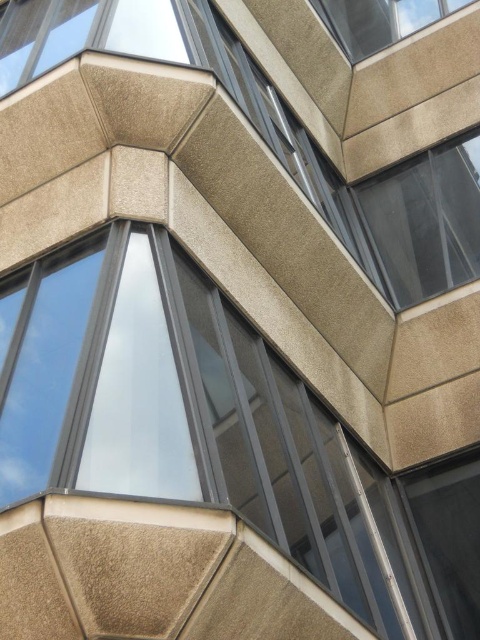
Is clear glass window at center bigger than transparent glass window at upper right?

Yes, clear glass window at center is bigger than transparent glass window at upper right.

How far apart are clear glass window at center and transparent glass window at upper right?

clear glass window at center is 25.28 feet from transparent glass window at upper right.

What do you see at coordinates (218, 429) in the screenshot? I see `clear glass window at center` at bounding box center [218, 429].

Locate an element on the screen. This screenshot has height=640, width=480. clear glass window at center is located at coordinates (218, 429).

Between transparent glass window at upper right and slate gray concrete window at upper right, which one is positioned lower?

transparent glass window at upper right is lower down.

How distant is transparent glass window at upper right from slate gray concrete window at upper right?

The distance of transparent glass window at upper right from slate gray concrete window at upper right is 8.04 meters.

Locate an element on the screen. This screenshot has height=640, width=480. transparent glass window at upper right is located at coordinates (424, 220).

Can you confirm if clear glass window at center is wider than slate gray concrete window at upper right?

Yes.

Where is `clear glass window at center`? This screenshot has height=640, width=480. clear glass window at center is located at coordinates (218, 429).

Image resolution: width=480 pixels, height=640 pixels. What do you see at coordinates (218, 429) in the screenshot? I see `clear glass window at center` at bounding box center [218, 429].

Locate an element on the screen. clear glass window at center is located at coordinates (218, 429).